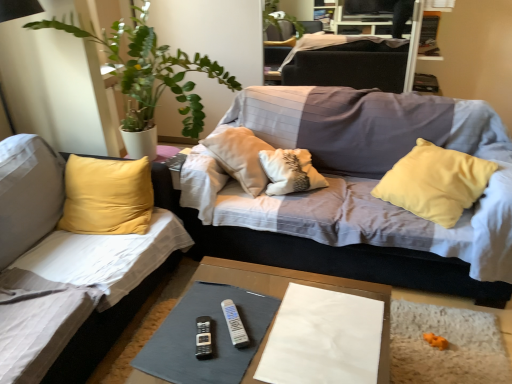
Where is `dark gray fabric couch at upper center`? Image resolution: width=512 pixels, height=384 pixels. dark gray fabric couch at upper center is located at coordinates (347, 62).

Locate an element on the screen. smooth gray fabric at center is located at coordinates (298, 283).

The height and width of the screenshot is (384, 512). What do you see at coordinates (59, 261) in the screenshot?
I see `yellow fabric studio couch at left, which appears as the 1th studio couch when viewed from the left` at bounding box center [59, 261].

In order to face yellow fabric studio couch at left, the 2th studio couch viewed from the right, should I rotate leftwards or rightwards?

Rotate your view left by about 27.025°.

Locate an element on the screen. textured gray couch at center, the 2th studio couch positioned from the left is located at coordinates (349, 189).

Measure the distance from black plastic remote at center, the 1th remote in the left-to-right sequence, to green leafy plant at left.

They are 1.50 meters apart.

From the image's perspective, is black plastic remote at center, the 1th remote in the left-to-right sequence, beneath green leafy plant at left?

Correct, black plastic remote at center, the 1th remote in the left-to-right sequence, appears lower than green leafy plant at left in the image.

Considering the sizes of objects black plastic remote at center, the 1th remote in the left-to-right sequence, and green leafy plant at left in the image provided, who is thinner, black plastic remote at center, the 1th remote in the left-to-right sequence, or green leafy plant at left?

black plastic remote at center, the 1th remote in the left-to-right sequence, is thinner.

In the scene shown: Is the depth of black plastic remote at center, the 1th remote in the left-to-right sequence, less than that of green leafy plant at left?

Yes, it is in front of green leafy plant at left.

From the image's perspective, is white paper at center above green leafy plant at left?

Actually, white paper at center appears below green leafy plant at left in the image.

This screenshot has width=512, height=384. Find the location of `sheet in front of the green leafy plant at left`. sheet in front of the green leafy plant at left is located at coordinates (323, 339).

How different are the orientations of white paper at center and green leafy plant at left in degrees?

The angle between the facing direction of white paper at center and the facing direction of green leafy plant at left is 86 degrees.

Is white paper at center completely or partially outside of green leafy plant at left?

Indeed, white paper at center is completely outside green leafy plant at left.

Is white plastic remote at center, which is the 1th remote from right to left, turned away from black plastic remote at center, the 1th remote in the left-to-right sequence?

No, white plastic remote at center, which is the 1th remote from right to left, is not facing away from black plastic remote at center, the 1th remote in the left-to-right sequence.

The height and width of the screenshot is (384, 512). I want to click on remote behind the black plastic remote at center, the 1th remote in the left-to-right sequence, so click(x=234, y=324).

Which is more to the right, white plastic remote at center, which is the 1th remote from right to left, or black plastic remote at center, which is the second remote from right to left?

white plastic remote at center, which is the 1th remote from right to left, is more to the right.

Consider the image. Between white plastic remote at center, which is counted as the second remote, starting from the left, and black plastic remote at center, the 1th remote in the left-to-right sequence, which one has more height?

white plastic remote at center, which is counted as the second remote, starting from the left, is taller.

Based on the photo, is yellow fabric studio couch at left, the 2th studio couch viewed from the right, thinner than dark gray fabric couch at upper center?

No.

From a real-world perspective, does yellow fabric studio couch at left, which appears as the 1th studio couch when viewed from the left, sit lower than dark gray fabric couch at upper center?

Yes.

From the image's perspective, is yellow fabric studio couch at left, which appears as the 1th studio couch when viewed from the left, below dark gray fabric couch at upper center?

Yes, from the image's perspective, yellow fabric studio couch at left, which appears as the 1th studio couch when viewed from the left, is below dark gray fabric couch at upper center.

Which object is more forward, yellow fabric studio couch at left, the 2th studio couch viewed from the right, or dark gray fabric couch at upper center?

yellow fabric studio couch at left, the 2th studio couch viewed from the right, is in front.

How much distance is there between textured gray couch at center, the 2th studio couch positioned from the left, and black plastic remote at center, which is the second remote from right to left?

The distance of textured gray couch at center, the 2th studio couch positioned from the left, from black plastic remote at center, which is the second remote from right to left, is 3.64 feet.

Which is farther, (271,124) or (197,356)?

The point (271,124) is farther from the camera.

From the image's perspective, who appears lower, textured gray couch at center, which is the first studio couch in right-to-left order, or black plastic remote at center, which is the second remote from right to left?

black plastic remote at center, which is the second remote from right to left.

There is a black plastic remote at center, the 1th remote in the left-to-right sequence. At what (x,y) coordinates should I click in order to perform the action: click on the 2nd studio couch above it (from a real-world perspective). Please return your answer as a coordinate pair (x, y). Looking at the image, I should click on (349, 189).

Between white plastic remote at center, which is counted as the second remote, starting from the left, and green leafy plant at left, which one appears on the left side from the viewer's perspective?

Positioned to the left is green leafy plant at left.

Image resolution: width=512 pixels, height=384 pixels. Identify the location of the 2nd remote to the right of the green leafy plant at left, counting from the anchor's position. (234, 324).

Is white plastic remote at center, which is the 1th remote from right to left, turned away from green leafy plant at left?

No, green leafy plant at left is not at the back of white plastic remote at center, which is the 1th remote from right to left.

From the picture: In terms of height, does white plastic remote at center, which is counted as the second remote, starting from the left, look taller or shorter compared to green leafy plant at left?

Considering their sizes, white plastic remote at center, which is counted as the second remote, starting from the left, has less height than green leafy plant at left.

Could you tell me if white paper at center is facing smooth gray fabric at center?

Yes, white paper at center is oriented towards smooth gray fabric at center.

Where is `table on the left of white paper at center`? This screenshot has width=512, height=384. table on the left of white paper at center is located at coordinates (298, 283).

Consider the image. Would you consider white paper at center to be distant from smooth gray fabric at center?

They are positioned close to each other.

Measure the distance from white paper at center to smooth gray fabric at center.

The distance of white paper at center from smooth gray fabric at center is 4.37 inches.

At what (x,y) coordinates should I click in order to perform the action: click on houseplant that is on the left side of black plastic remote at center, the 1th remote in the left-to-right sequence. Please return your answer as a coordinate pair (x, y). Looking at the image, I should click on (149, 71).

Locate an element on the screen. The image size is (512, 384). sheet that appears in front of the green leafy plant at left is located at coordinates (323, 339).

When comparing their distances from white plastic remote at center, which is the 1th remote from right to left, does textured gray couch at center, which is the first studio couch in right-to-left order, or yellow fabric studio couch at left, which appears as the 1th studio couch when viewed from the left, seem closer?

yellow fabric studio couch at left, which appears as the 1th studio couch when viewed from the left.

Based on their spatial positions, is textured gray couch at center, which is the first studio couch in right-to-left order, or white paper at center further from black plastic remote at center, the 1th remote in the left-to-right sequence?

textured gray couch at center, which is the first studio couch in right-to-left order, is positioned further to the anchor black plastic remote at center, the 1th remote in the left-to-right sequence.

Looking at the image, which one is located closer to white paper at center, yellow fabric studio couch at left, the 2th studio couch viewed from the right, or black plastic remote at center, which is the second remote from right to left?

black plastic remote at center, which is the second remote from right to left, is positioned closer to the anchor white paper at center.

Based on their spatial positions, is textured gray couch at center, which is the first studio couch in right-to-left order, or yellow fabric studio couch at left, which appears as the 1th studio couch when viewed from the left, closer to smooth gray fabric at center?

The object closer to smooth gray fabric at center is textured gray couch at center, which is the first studio couch in right-to-left order.

Based on their spatial positions, is textured gray couch at center, which is the first studio couch in right-to-left order, or smooth gray fabric at center closer to white plastic remote at center, which is counted as the second remote, starting from the left?

smooth gray fabric at center is closer to white plastic remote at center, which is counted as the second remote, starting from the left.

Based on their spatial positions, is white paper at center or dark gray fabric couch at upper center further from white plastic remote at center, which is counted as the second remote, starting from the left?

dark gray fabric couch at upper center is positioned further to the anchor white plastic remote at center, which is counted as the second remote, starting from the left.

Looking at the image, which one is located further to smooth gray fabric at center, yellow fabric studio couch at left, the 2th studio couch viewed from the right, or textured gray couch at center, which is the first studio couch in right-to-left order?

Based on the image, yellow fabric studio couch at left, the 2th studio couch viewed from the right, appears to be further to smooth gray fabric at center.

From the image, which object appears to be farther from smooth gray fabric at center, black plastic remote at center, the 1th remote in the left-to-right sequence, or dark gray fabric couch at upper center?

dark gray fabric couch at upper center.

The height and width of the screenshot is (384, 512). I want to click on sheet between green leafy plant at left and smooth gray fabric at center vertically, so click(323, 339).

At what (x,y) coordinates should I click in order to perform the action: click on table between white plastic remote at center, which is counted as the second remote, starting from the left, and white paper at center from left to right. Please return your answer as a coordinate pair (x, y). The image size is (512, 384). Looking at the image, I should click on pyautogui.click(x=298, y=283).

You are a GUI agent. You are given a task and a screenshot of the screen. Output one action in this format:
    pyautogui.click(x=<x>, y=<y>)
    Task: Click on the remote between dark gray fabric couch at upper center and black plastic remote at center, the 1th remote in the left-to-right sequence, vertically
    The image size is (512, 384).
    Given the screenshot: What is the action you would take?
    pyautogui.click(x=234, y=324)

At what (x,y) coordinates should I click in order to perform the action: click on houseplant between dark gray fabric couch at upper center and white plastic remote at center, which is counted as the second remote, starting from the left, from top to bottom. Please return your answer as a coordinate pair (x, y). This screenshot has width=512, height=384. Looking at the image, I should click on (149, 71).